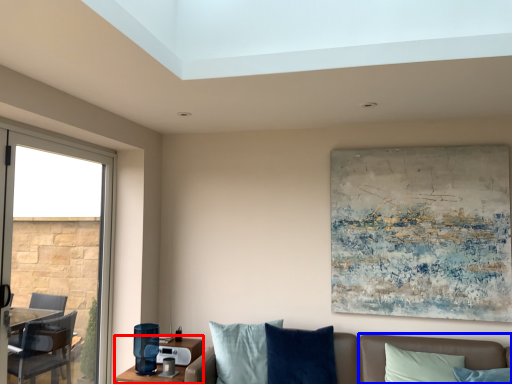
Question: Which point is further to the camera, table (highlighted by a red box) or couch (highlighted by a blue box)?

Choices:
 (A) table
 (B) couch

Answer: (A)